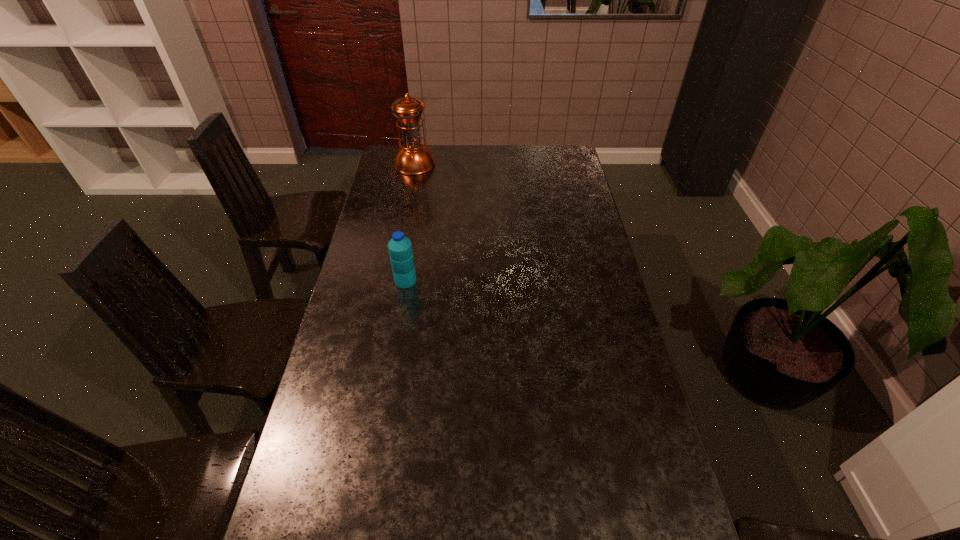
Locate an element on the screen. This screenshot has height=540, width=960. the taller object is located at coordinates (413, 158).

Find the location of a particular element. the farther object is located at coordinates (413, 158).

Image resolution: width=960 pixels, height=540 pixels. I want to click on the shorter object, so click(x=400, y=248).

Find the location of a particular element. water bottle is located at coordinates (400, 248).

Image resolution: width=960 pixels, height=540 pixels. Identify the location of vacant region located 0.270m on the right of the farther object. coord(494,164).

You are a GUI agent. You are given a task and a screenshot of the screen. Output one action in this format:
    pyautogui.click(x=<x>, y=<y>)
    Task: Click on the free space located 0.200m on the right of the shorter object
    
    Given the screenshot: What is the action you would take?
    pyautogui.click(x=475, y=281)

You are a GUI agent. You are given a task and a screenshot of the screen. Output one action in this format:
    pyautogui.click(x=<x>, y=<y>)
    Task: Click on the object located at the far edge
    
    Given the screenshot: What is the action you would take?
    pyautogui.click(x=413, y=158)

The image size is (960, 540). I want to click on oil lamp that is at the left edge, so click(413, 158).

In order to click on water bottle that is at the left edge in this screenshot , I will do (400, 248).

Where is `object present at the far left corner`? The width and height of the screenshot is (960, 540). object present at the far left corner is located at coordinates (413, 158).